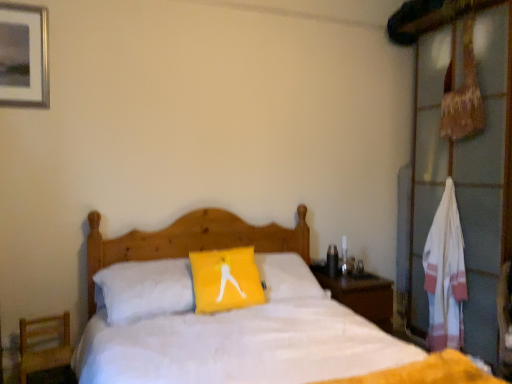
Describe the element at coordinates (465, 169) in the screenshot. Image resolution: width=512 pixels, height=384 pixels. I see `white wood dresser at right` at that location.

Where is `wooden chair at lower left`? The height and width of the screenshot is (384, 512). wooden chair at lower left is located at coordinates (44, 344).

What do you see at coordinates (189, 242) in the screenshot? Image resolution: width=512 pixels, height=384 pixels. I see `wooden bed at center` at bounding box center [189, 242].

This screenshot has height=384, width=512. Identify the location of white striped towel at right. (445, 274).

Locate an element on the screen. This screenshot has width=512, height=384. yellow fabric pillow at center is located at coordinates (225, 279).

You are a GUI agent. You are given a task and a screenshot of the screen. Output one action in this format:
    pyautogui.click(x=<x>, y=<y>)
    Task: Click on the metallic silver picture frame at upper left
    
    Given the screenshot: What is the action you would take?
    pyautogui.click(x=28, y=55)

Which of these two, white wood dresser at right or yellow fabric pillow at center, is smaller?

yellow fabric pillow at center.

Is white wood dresser at right positioned with its back to yellow fabric pillow at center?

white wood dresser at right does not have its back to yellow fabric pillow at center.

Is white wood dresser at right to the left or to the right of yellow fabric pillow at center in the image?

From the image, it's evident that white wood dresser at right is to the right of yellow fabric pillow at center.

You are a GUI agent. You are given a task and a screenshot of the screen. Output one action in this format:
    pyautogui.click(x=<x>, y=<y>)
    Task: Click on the pillow that appears on the left of white wood dresser at right
    
    Given the screenshot: What is the action you would take?
    225,279

Which is nearer, (45, 37) or (486, 191)?

Point (45, 37) is positioned closer to the camera compared to point (486, 191).

Locate an element on the screen. The image size is (512, 384). picture frame that is above the white wood dresser at right (from the image's perspective) is located at coordinates (28, 55).

Considering the positions of objects metallic silver picture frame at upper left and white wood dresser at right in the image provided, who is more to the right, metallic silver picture frame at upper left or white wood dresser at right?

white wood dresser at right is more to the right.

Who is taller, wooden chair at lower left or white striped towel at right?

white striped towel at right.

Can you confirm if wooden chair at lower left is positioned to the right of white striped towel at right?

No, wooden chair at lower left is not to the right of white striped towel at right.

Which is closer, (66, 322) or (426, 284)?

Point (66, 322).

Is wooden chair at lower left facing towards white striped towel at right?

No, wooden chair at lower left is not facing towards white striped towel at right.

Identify the location of armchair below the wooden bed at center (from a real-world perspective). (44, 344).

Is wooden bed at center facing towards wooden chair at lower left?

No.

Is wooden bed at center not near wooden chair at lower left?

No.

Measure the distance from metallic silver picture frame at upper left to yellow fabric pillow at center.

metallic silver picture frame at upper left is 1.47 meters from yellow fabric pillow at center.

Which object is positioned more to the left, metallic silver picture frame at upper left or yellow fabric pillow at center?

metallic silver picture frame at upper left.

Looking at this image, is there a large distance between metallic silver picture frame at upper left and yellow fabric pillow at center?

Absolutely, metallic silver picture frame at upper left is distant from yellow fabric pillow at center.

In the scene shown: Who is smaller, metallic silver picture frame at upper left or yellow fabric pillow at center?

metallic silver picture frame at upper left is smaller.

Locate an element on the screen. bed above the wooden nightstand at right (from the image's perspective) is located at coordinates (189, 242).

From a real-world perspective, is wooden bed at center on top of wooden nightstand at right?

Yes, from a real-world perspective, wooden bed at center is on top of wooden nightstand at right.

From the image's perspective, is wooden bed at center on wooden nightstand at right?

Yes, from the image's perspective, wooden bed at center is on top of wooden nightstand at right.

Is wooden bed at center further to camera compared to wooden nightstand at right?

No, wooden bed at center is in front of wooden nightstand at right.

Find the location of a particular element. pillow that is above the wooden nightstand at right (from a real-world perspective) is located at coordinates (225, 279).

From the image's perspective, is yellow fabric pillow at center located above or below wooden nightstand at right?

yellow fabric pillow at center is above wooden nightstand at right.

How much distance is there between yellow fabric pillow at center and wooden nightstand at right?

75.72 centimeters.

Is yellow fabric pillow at center taller than wooden nightstand at right?

Indeed, yellow fabric pillow at center has a greater height compared to wooden nightstand at right.

Where is `pillow below the white wood dresser at right (from the image's perspective)`? Image resolution: width=512 pixels, height=384 pixels. pillow below the white wood dresser at right (from the image's perspective) is located at coordinates (225, 279).

Identify the location of dresser that is behind the metallic silver picture frame at upper left. This screenshot has width=512, height=384. (465, 169).

Based on their spatial positions, is metallic silver picture frame at upper left or yellow fabric pillow at center further from white striped towel at right?

Among the two, metallic silver picture frame at upper left is located further to white striped towel at right.

Considering their positions, is yellow fabric pillow at center positioned further to white striped towel at right than wooden nightstand at right?

Among the two, yellow fabric pillow at center is located further to white striped towel at right.

Estimate the real-world distances between objects in this image. Which object is further from wooden chair at lower left, yellow fabric pillow at center or wooden bed at center?

yellow fabric pillow at center.

When comparing their distances from metallic silver picture frame at upper left, does white wood dresser at right or wooden nightstand at right seem closer?

wooden nightstand at right is closer to metallic silver picture frame at upper left.

Based on their spatial positions, is wooden chair at lower left or wooden nightstand at right further from wooden bed at center?

wooden nightstand at right.

Based on their spatial positions, is yellow fabric pillow at center or white wood dresser at right further from wooden nightstand at right?

The object further to wooden nightstand at right is white wood dresser at right.

When comparing their distances from yellow fabric pillow at center, does wooden chair at lower left or wooden bed at center seem closer?

wooden bed at center is positioned closer to the anchor yellow fabric pillow at center.

From the image, which object appears to be nearer to metallic silver picture frame at upper left, yellow fabric pillow at center or wooden bed at center?

wooden bed at center.

Image resolution: width=512 pixels, height=384 pixels. I want to click on pillow between wooden bed at center and white striped towel at right along the z-axis, so click(225, 279).

The image size is (512, 384). What are the coordinates of `material situated between metallic silver picture frame at upper left and white wood dresser at right from left to right` in the screenshot? It's located at (445, 274).

At what (x,y) coordinates should I click in order to perform the action: click on nightstand between metallic silver picture frame at upper left and white striped towel at right from left to right. Please return your answer as a coordinate pair (x, y). The height and width of the screenshot is (384, 512). Looking at the image, I should click on (361, 295).

Identify the location of nightstand between wooden chair at lower left and white wood dresser at right. This screenshot has width=512, height=384. (361, 295).